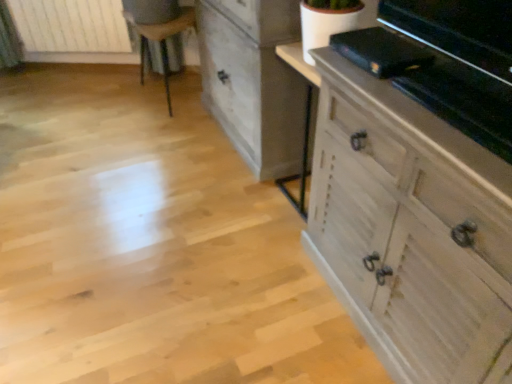
The width and height of the screenshot is (512, 384). In order to click on free point below white wooden radiator at upper left (from a real-world perspective) in this screenshot , I will do `click(87, 71)`.